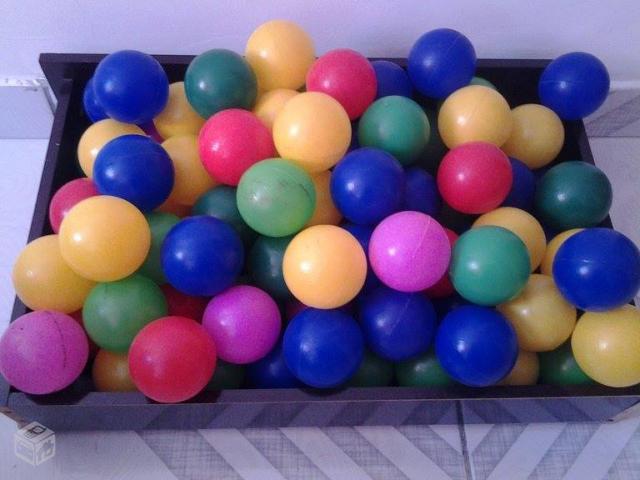
Where is `drawer`? drawer is located at coordinates (496, 396).